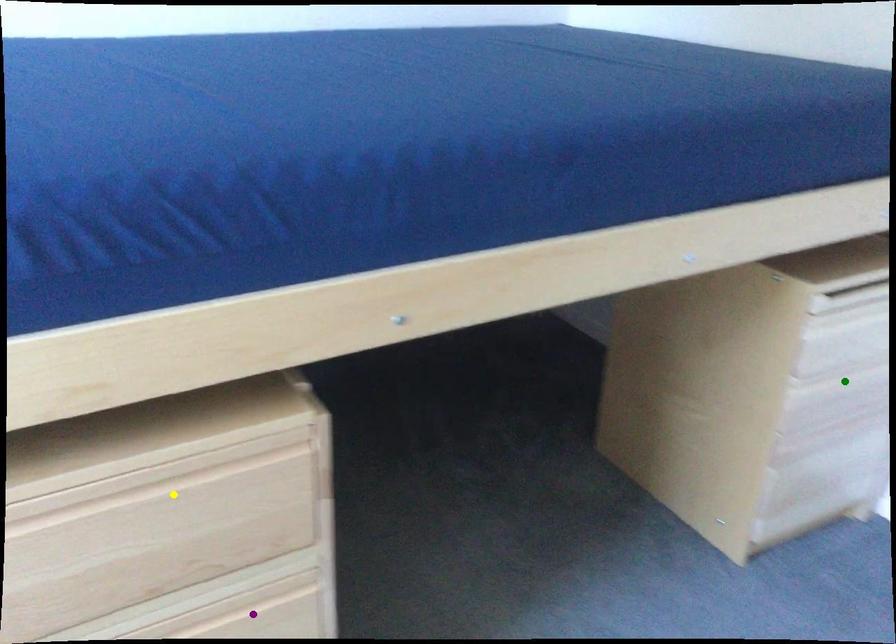
Order these from nearest to farthest:
green point | yellow point | purple point

yellow point < purple point < green point